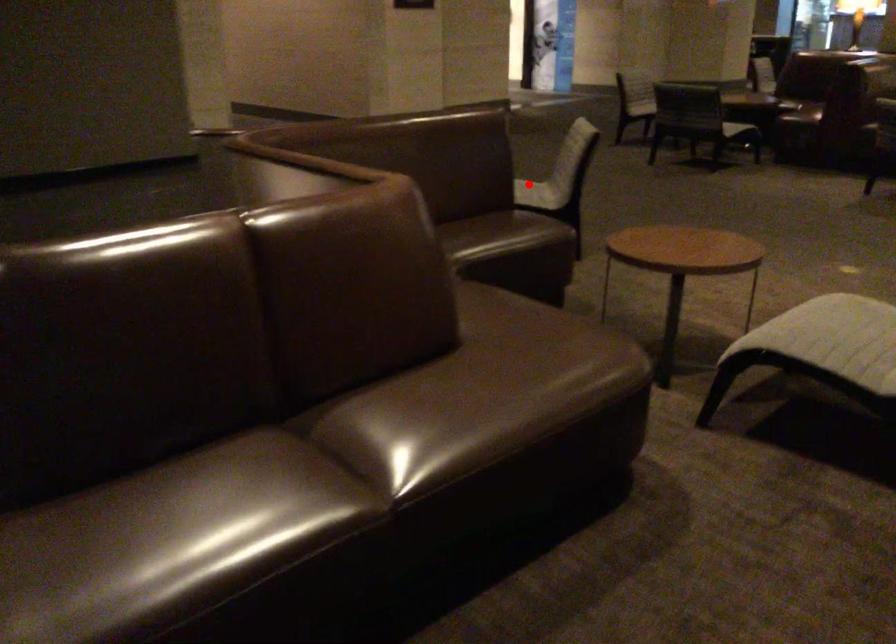
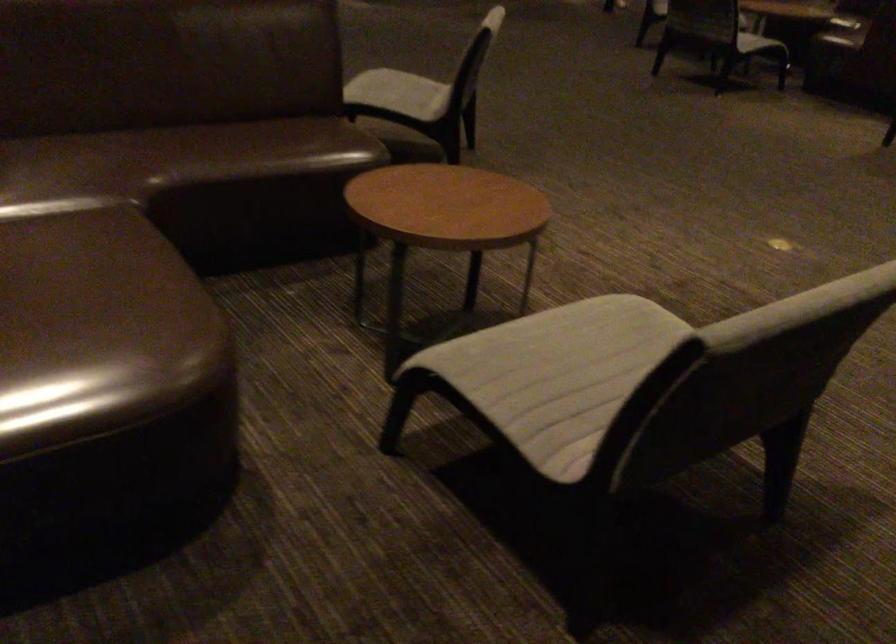
Question: I am providing you with two images of the same scene from different viewpoints. Given a red point in image1, look at the same physical point in image2. Is it:

Choices:
 (A) Closer to the viewpoint
 (B) Farther from the viewpoint

Answer: (A)